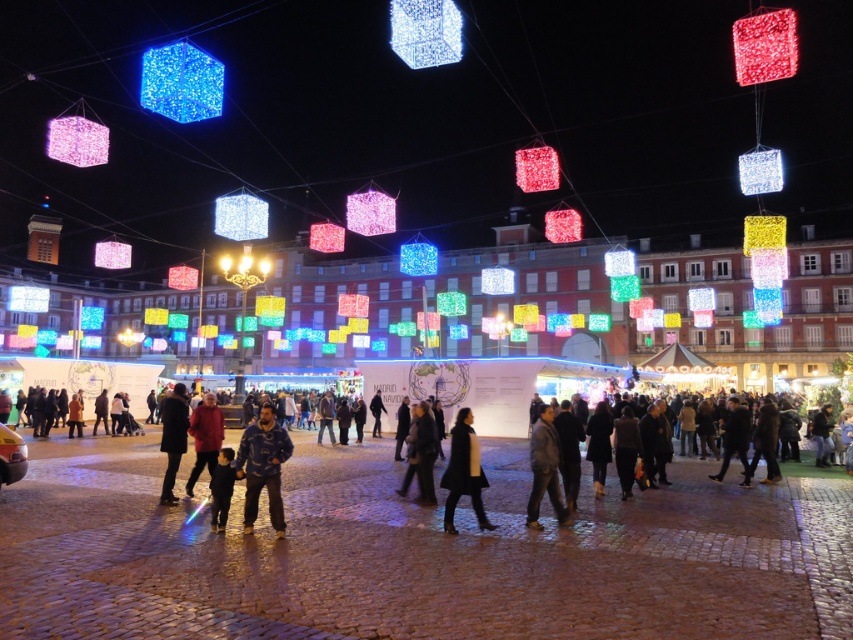
From the picture: You are a photographer standing in the square and want to capture both the illuminated glass cube at upper center and the black leather jacket at center in a single photo. Which object should you focus on first to ensure both are in frame?

The illuminated glass cube at upper center is taller than the black leather jacket at center, so you should focus on the illuminated glass cube at upper center first to ensure both are in frame.

You are standing in the square and want to take a photo of the matte blue cube at upper left and the black leather jacket at center. Which object should you position to the left side of your camera frame to include both in the shot?

To include both the matte blue cube at upper left and the black leather jacket at center in your photo, position the matte blue cube at upper left to the left side of your camera frame since it is already to the left of the black leather jacket at center.